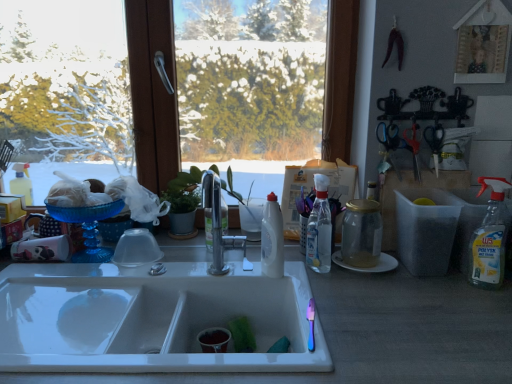
Question: From a real-world perspective, is clear glass bottle at center, marked as the first bottle in a right-to-left arrangement, above or below green leafy plant at center?

Choices:
 (A) above
 (B) below

Answer: (A)

Question: Looking at the image, does clear glass bottle at center, the 2th bottle positioned from the left, seem bigger or smaller compared to green leafy plant at center?

Choices:
 (A) big
 (B) small

Answer: (B)

Question: Which of these objects is positioned closest to the white plastic bottle at center, the first bottle in the left-to-right sequence?

Choices:
 (A) transparent glass window at upper center
 (B) green leafy plant at center
 (C) white ceramic sink at center
 (D) blue plastic scissors at upper right, arranged as the second scissors when viewed from the right
 (E) metallic silver scissors at right, the first scissors viewed from the right

Answer: (C)

Question: Estimate the real-world distances between objects in this image. Which object is farther from the white ceramic sink at center?

Choices:
 (A) green leafy plant at center
 (B) clear plastic spray bottle at right
 (C) white plastic bottle at center, the first bottle in the left-to-right sequence
 (D) metallic silver scissors at right, which ranks as the 2th scissors in left-to-right order
 (E) blue plastic scissors at upper right, which appears as the first scissors when viewed from the left

Answer: (A)